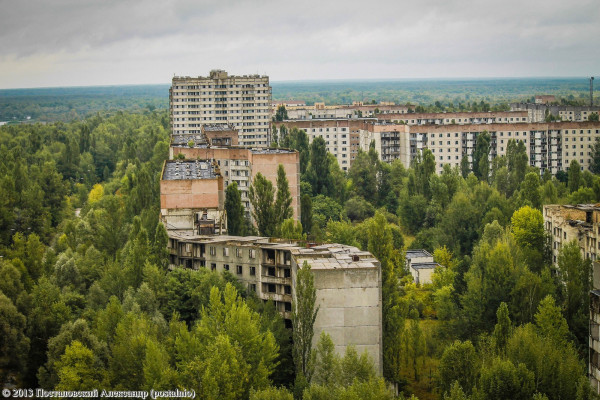
At what (x,y) coordinates should I click in order to perform the action: click on window. Please return your answer as a coordinate pair (x, y). Image resolution: width=600 pixels, height=400 pixels. Looking at the image, I should click on (252, 277).